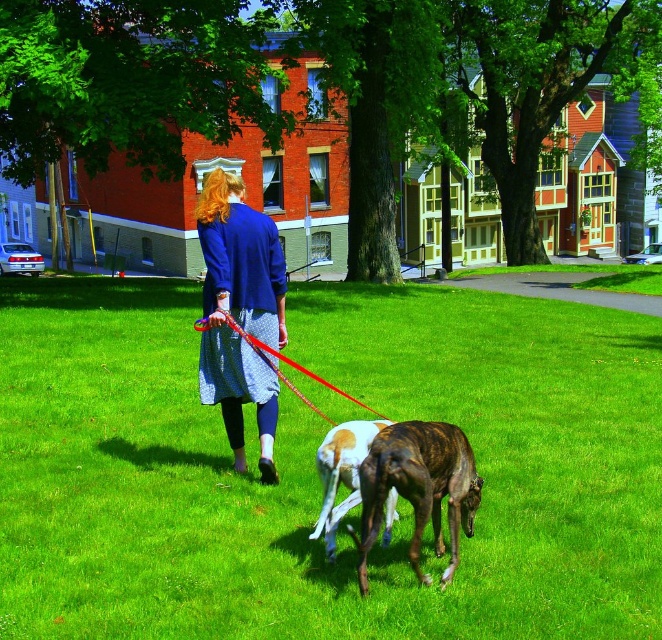
You are standing at the point marked as point [314,467]. What is the color of the ground beneath your feet?

The green grass at center is located at point [314,467], so the ground beneath your feet is green grass.

You are a photographer trying to capture the person and their dogs in the scene. Since you want to ensure the blue cotton jacket at center and the brown and white fur at center are both visible, which one should you focus on first to ensure proper focus?

The blue cotton jacket at center should be focused on first because it is taller than the brown and white fur at center, ensuring it is in focus while the smaller object remains visible.

You are standing on the lawn and want to walk towards the two points marked in the image. Which point, point (99, 381) or point (312, 376), will you reach first?

Point (99, 381) is further to the viewer than point (312, 376), so you will reach point (99, 381) first.